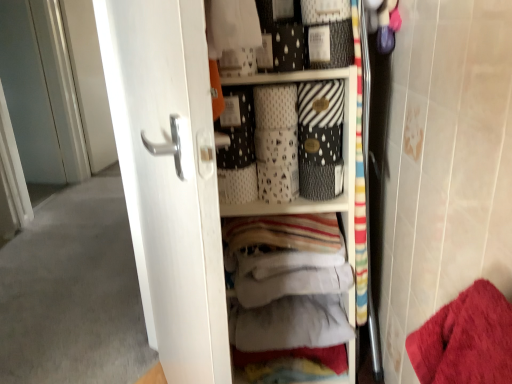
This screenshot has height=384, width=512. Find the location of `white glossy door at left, which is the 1th screen door in left-to-right order`. white glossy door at left, which is the 1th screen door in left-to-right order is located at coordinates (41, 92).

Measure the distance between white matte baskets at upper center and camera.

The depth of white matte baskets at upper center is 55.40 centimeters.

At what (x,y) coordinates should I click in order to perform the action: click on white glossy door at center, the 2th screen door viewed from the left. Please return your answer as a coordinate pair (x, y). The image size is (512, 384). Looking at the image, I should click on (169, 178).

In order to click on white glossy door at left, which ranks as the first screen door in back-to-front order in this screenshot , I will do `click(41, 92)`.

Is white glossy door at center, which is the 1th screen door from right to left, situated inside white glossy door at left, which ranks as the first screen door in back-to-front order, or outside?

white glossy door at center, which is the 1th screen door from right to left, cannot be found inside white glossy door at left, which ranks as the first screen door in back-to-front order.

Which point is more forward, (183, 30) or (75, 133)?

The point (183, 30) is in front.

Are white glossy door at center, the second screen door positioned from the back, and white glossy door at left, which is the 2th screen door in front-to-back order, beside each other?

white glossy door at center, the second screen door positioned from the back, and white glossy door at left, which is the 2th screen door in front-to-back order, are not in contact.

Is the position of white glossy door at center, which is the 1th screen door from right to left, more distant than that of white glossy door at left, which is the 2th screen door in front-to-back order?

No, white glossy door at center, which is the 1th screen door from right to left, is in front of white glossy door at left, which is the 2th screen door in front-to-back order.

Is white glossy door at left, the second screen door from the right, not inside white glossy door at center, the second screen door positioned from the back?

Absolutely, white glossy door at left, the second screen door from the right, is external to white glossy door at center, the second screen door positioned from the back.

How different are the orientations of white glossy door at left, which is the 2th screen door in front-to-back order, and white glossy door at center, the second screen door positioned from the back, in degrees?

157 degrees.

Is point (82, 154) positioned behind point (170, 154)?

Yes, point (82, 154) is behind point (170, 154).

Consider the image. Is white glossy door at left, which is the 1th screen door in left-to-right order, not close to white glossy door at center, the first screen door viewed from the front?

white glossy door at left, which is the 1th screen door in left-to-right order, is far away from white glossy door at center, the first screen door viewed from the front.

Between white matte baskets at upper center and white glossy door at center, which is the 1th screen door from right to left, which one has larger size?

white glossy door at center, which is the 1th screen door from right to left, is bigger.

From the image's perspective, which one is positioned lower, white matte baskets at upper center or white glossy door at center, the first screen door viewed from the front?

white glossy door at center, the first screen door viewed from the front.

Considering the sizes of objects white matte baskets at upper center and white glossy door at center, the second screen door positioned from the back, in the image provided, who is taller, white matte baskets at upper center or white glossy door at center, the second screen door positioned from the back,?

white glossy door at center, the second screen door positioned from the back.

Based on their positions, is white matte baskets at upper center located to the left or right of white glossy door at center, the first screen door viewed from the front?

white matte baskets at upper center is positioned on white glossy door at center, the first screen door viewed from the front,'s right side.

Considering the sizes of white matte baskets at upper center and white glossy door at left, which ranks as the first screen door in back-to-front order, in the image, is white matte baskets at upper center bigger or smaller than white glossy door at left, which ranks as the first screen door in back-to-front order,?

In the image, white matte baskets at upper center appears to be smaller than white glossy door at left, which ranks as the first screen door in back-to-front order.

Which point is more forward, [166,201] or [47,174]?

Point [166,201]

Based on the photo, from a real-world perspective, is white matte baskets at upper center positioned under white glossy door at left, which ranks as the first screen door in back-to-front order, based on gravity?

Yes, from a real-world perspective, white matte baskets at upper center is under white glossy door at left, which ranks as the first screen door in back-to-front order.

I want to click on the 1st screen door counting from the left of the white matte baskets at upper center, so click(169, 178).

Could you tell me if white glossy door at center, which is the 1th screen door from right to left, is facing white matte baskets at upper center?

Yes, white glossy door at center, which is the 1th screen door from right to left, is oriented towards white matte baskets at upper center.

From the image's perspective, is white glossy door at center, the first screen door viewed from the front, located above white matte baskets at upper center?

No, from the image's perspective, white glossy door at center, the first screen door viewed from the front, is not above white matte baskets at upper center.

Is white glossy door at left, the second screen door from the right, looking in the opposite direction of white matte baskets at upper center?

white glossy door at left, the second screen door from the right, is not turned away from white matte baskets at upper center.

Is white glossy door at left, which ranks as the first screen door in back-to-front order, positioned far away from white matte baskets at upper center?

Yes, white glossy door at left, which ranks as the first screen door in back-to-front order, and white matte baskets at upper center are located far from each other.

Between point (22, 156) and point (128, 145), which one is positioned behind?

The point (22, 156) is farther from the camera.

Looking at the image, does white glossy door at left, which is the 1th screen door in left-to-right order, seem bigger or smaller compared to white matte baskets at upper center?

white glossy door at left, which is the 1th screen door in left-to-right order, is bigger than white matte baskets at upper center.

At what (x,y) coordinates should I click in order to perform the action: click on screen door on the left of white glossy door at center, the 2th screen door viewed from the left. Please return your answer as a coordinate pair (x, y). The height and width of the screenshot is (384, 512). Looking at the image, I should click on (41, 92).

This screenshot has width=512, height=384. What are the coordinates of `screen door in front of the white glossy door at left, which ranks as the first screen door in back-to-front order` in the screenshot? It's located at (169, 178).

Estimate the real-world distances between objects in this image. Which object is further from white glossy door at center, which is the 1th screen door from right to left, white glossy door at left, which is the 2th screen door in front-to-back order, or white matte baskets at upper center?

Based on the image, white glossy door at left, which is the 2th screen door in front-to-back order, appears to be further to white glossy door at center, which is the 1th screen door from right to left.

When comparing their distances from white glossy door at left, which ranks as the first screen door in back-to-front order, does white glossy door at center, the first screen door viewed from the front, or white matte baskets at upper center seem closer?

The object closer to white glossy door at left, which ranks as the first screen door in back-to-front order, is white glossy door at center, the first screen door viewed from the front.

Which object lies nearer to the anchor point white glossy door at left, the second screen door from the right, white matte baskets at upper center or white glossy door at center, the 2th screen door viewed from the left?

white glossy door at center, the 2th screen door viewed from the left, is closer to white glossy door at left, the second screen door from the right.

Which object lies further to the anchor point white matte baskets at upper center, white glossy door at left, which is the 2th screen door in front-to-back order, or white glossy door at center, which is the 1th screen door from right to left?

The object further to white matte baskets at upper center is white glossy door at left, which is the 2th screen door in front-to-back order.

Looking at the image, which one is located further to white matte baskets at upper center, white glossy door at center, the 2th screen door viewed from the left, or white glossy door at left, which ranks as the first screen door in back-to-front order?

white glossy door at left, which ranks as the first screen door in back-to-front order, is positioned further to the anchor white matte baskets at upper center.

Estimate the real-world distances between objects in this image. Which object is closer to white glossy door at center, the first screen door viewed from the front, white matte baskets at upper center or white glossy door at left, the second screen door from the right?

Based on the image, white matte baskets at upper center appears to be nearer to white glossy door at center, the first screen door viewed from the front.

The width and height of the screenshot is (512, 384). What are the coordinates of `dresser positioned between white glossy door at center, which is the 1th screen door from right to left, and white glossy door at left, the second screen door from the right, from near to far` in the screenshot? It's located at (204, 178).